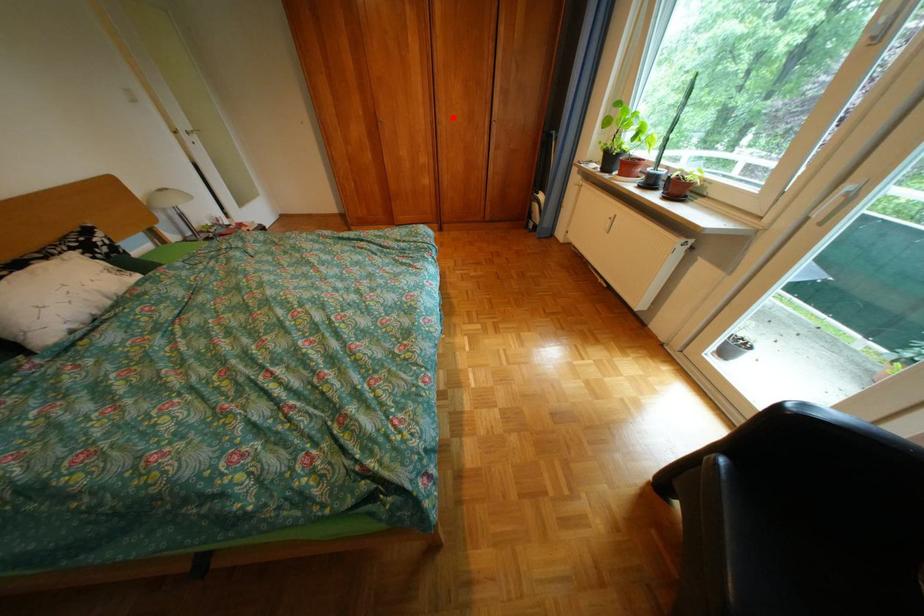
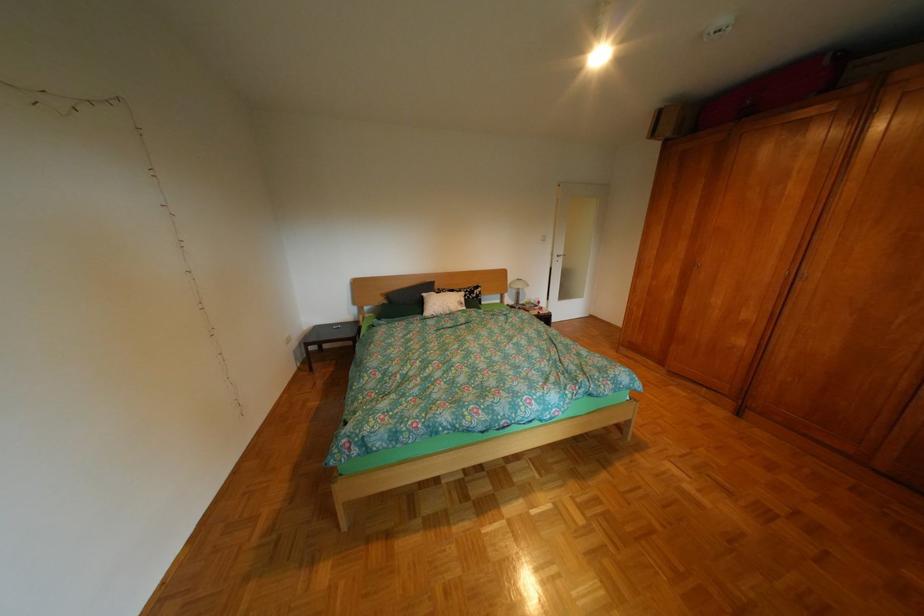
Locate, in the second image, the point that corresponds to the highlighted location in the first image.

(819, 273)